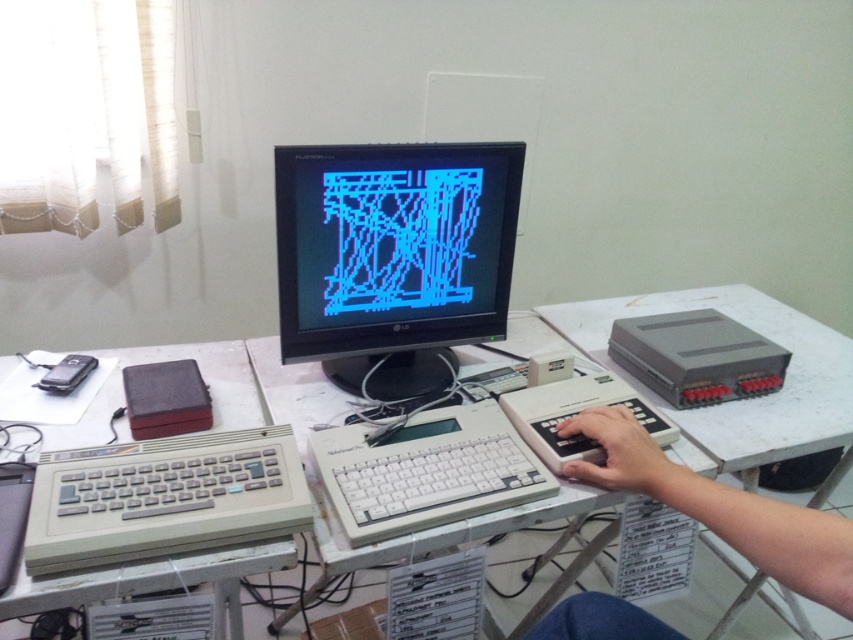
You are a technician trying to install a new cable between the black glossy monitor at center and the white plastic hand at center. The cable you have is 15 inches long. Will it be long enough to connect them without needing an extension?

The distance between the black glossy monitor at center and the white plastic hand at center is 17.44 inches, so the 15 inch cable is too short. You will need an extension or a longer cable to make the connection.

You are organizing a retro computing exhibit and need to place the gray plastic keyboard at center on the white plastic table at center. Based on the scene description, will the keyboard fit on the table?

The white plastic table at center is wider than the gray plastic keyboard at center, so the keyboard will fit on the table.

You are organizing a retro computing exhibit and need to place a white plastic hand at center on a white plastic table at center. Given that the table is larger than the hand, will the hand fit entirely on the table?

The white plastic table at center is bigger than the white plastic hand at center, so yes, the hand will fit entirely on the table.